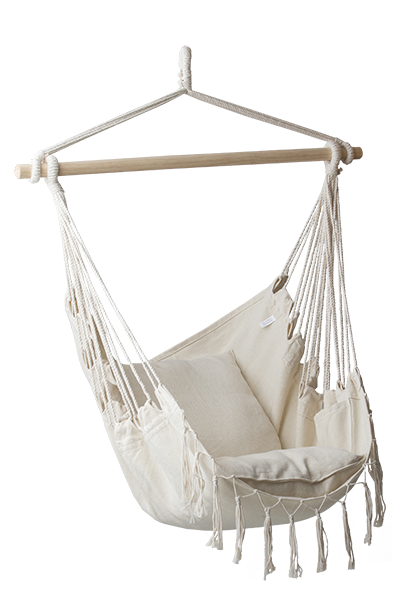
Identify the location of hammock seat. (250, 433).